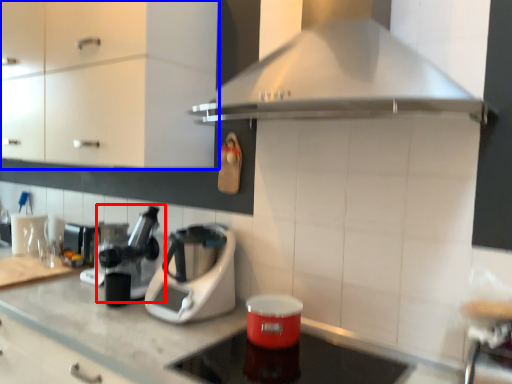
Question: Which of the following is the closest to the observer, coffee machine (highlighted by a red box) or cabinetry (highlighted by a blue box)?

Choices:
 (A) coffee machine
 (B) cabinetry

Answer: (B)